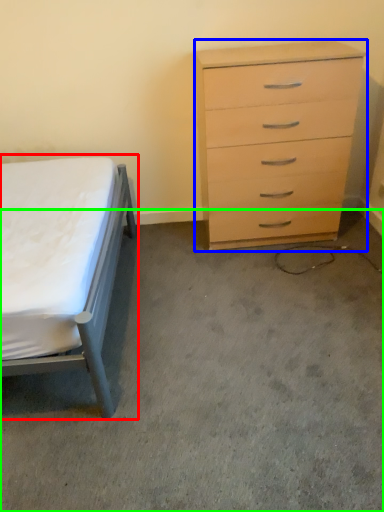
Question: Which object is the farthest from bed (highlighted by a red box)? Choose among these: chest of drawers (highlighted by a blue box) or concrete (highlighted by a green box).

Choices:
 (A) chest of drawers
 (B) concrete

Answer: (A)